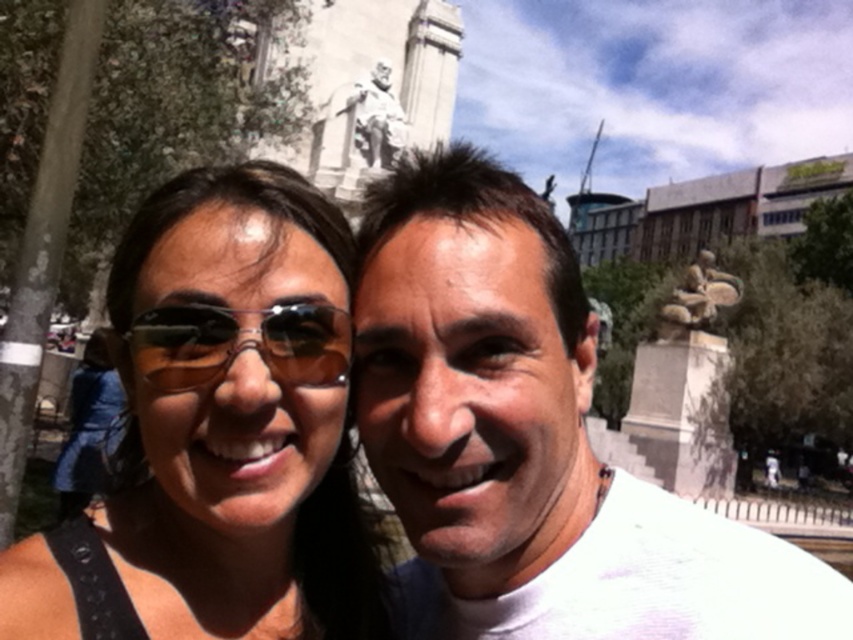
Can you confirm if matte black sunglasses at center is shorter than shiny black sunglasses at center?

Incorrect, matte black sunglasses at center's height does not fall short of shiny black sunglasses at center's.

Can you confirm if matte black sunglasses at center is positioned below shiny black sunglasses at center?

Indeed, matte black sunglasses at center is positioned under shiny black sunglasses at center.

At what (x,y) coordinates should I click in order to perform the action: click on matte black sunglasses at center. Please return your answer as a coordinate pair (x, y). The image size is (853, 640). Looking at the image, I should click on (239, 424).

This screenshot has height=640, width=853. In order to click on matte black sunglasses at center in this screenshot , I will do `click(239, 424)`.

Does white matte shirt at center have a greater height compared to shiny black sunglasses at center?

Yes.

Looking at this image, is white matte shirt at center wider than shiny black sunglasses at center?

Indeed, white matte shirt at center has a greater width compared to shiny black sunglasses at center.

Which is behind, point (527, 506) or point (252, 339)?

Positioned behind is point (527, 506).

In order to click on white matte shirt at center in this screenshot , I will do `click(531, 440)`.

Which is more to the right, white matte shirt at center or matte black sunglasses at center?

Positioned to the right is white matte shirt at center.

Which is behind, point (462, 326) or point (131, 259)?

The point (131, 259) is more distant.

This screenshot has height=640, width=853. What are the coordinates of `white matte shirt at center` in the screenshot? It's located at (531, 440).